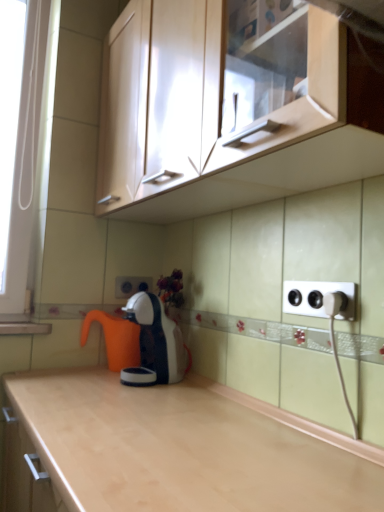
Question: Is orange plastic coffee pot at center not within white plastic electric outlet at center, which ranks as the first electric outlet in left-to-right order?

Choices:
 (A) no
 (B) yes

Answer: (B)

Question: Does orange plastic coffee pot at center lie behind white plastic electric outlet at center, which appears as the second electric outlet when viewed from the front?

Choices:
 (A) no
 (B) yes

Answer: (A)

Question: Considering the relative positions of orange plastic coffee pot at center and white plastic electric outlet at center, which appears as the second electric outlet when viewed from the front, in the image provided, is orange plastic coffee pot at center to the left of white plastic electric outlet at center, which appears as the second electric outlet when viewed from the front, from the viewer's perspective?

Choices:
 (A) no
 (B) yes

Answer: (B)

Question: Is orange plastic coffee pot at center to the right of white plastic electric outlet at center, the 1th electric outlet when ordered from back to front, from the viewer's perspective?

Choices:
 (A) yes
 (B) no

Answer: (B)

Question: From a real-world perspective, does orange plastic coffee pot at center sit lower than white plastic electric outlet at center, which appears as the second electric outlet when viewed from the front?

Choices:
 (A) yes
 (B) no

Answer: (A)

Question: Can you confirm if orange plastic coffee pot at center is thinner than white plastic electric outlet at center, the 1th electric outlet when ordered from back to front?

Choices:
 (A) no
 (B) yes

Answer: (A)

Question: Is white plastic electrical outlet at right, the 2th electric outlet from the left, to the right of white glossy coffee machine at center from the viewer's perspective?

Choices:
 (A) yes
 (B) no

Answer: (A)

Question: Is white plastic electrical outlet at right, arranged as the 2th electric outlet when viewed from the back, far from white glossy coffee machine at center?

Choices:
 (A) yes
 (B) no

Answer: (B)

Question: Is white plastic electrical outlet at right, arranged as the 2th electric outlet when viewed from the back, oriented away from white glossy coffee machine at center?

Choices:
 (A) yes
 (B) no

Answer: (B)

Question: Is white plastic electrical outlet at right, the 2th electric outlet from the left, positioned behind white glossy coffee machine at center?

Choices:
 (A) yes
 (B) no

Answer: (B)

Question: Does white plastic electrical outlet at right, placed as the first electric outlet when sorted from right to left, have a greater width compared to white glossy coffee machine at center?

Choices:
 (A) yes
 (B) no

Answer: (B)

Question: From the image's perspective, is white plastic electrical outlet at right, the 2th electric outlet from the left, above white glossy coffee machine at center?

Choices:
 (A) no
 (B) yes

Answer: (B)

Question: Could you tell me if matte wood cabinet at upper center is turned towards orange plastic coffee pot at center?

Choices:
 (A) no
 (B) yes

Answer: (A)